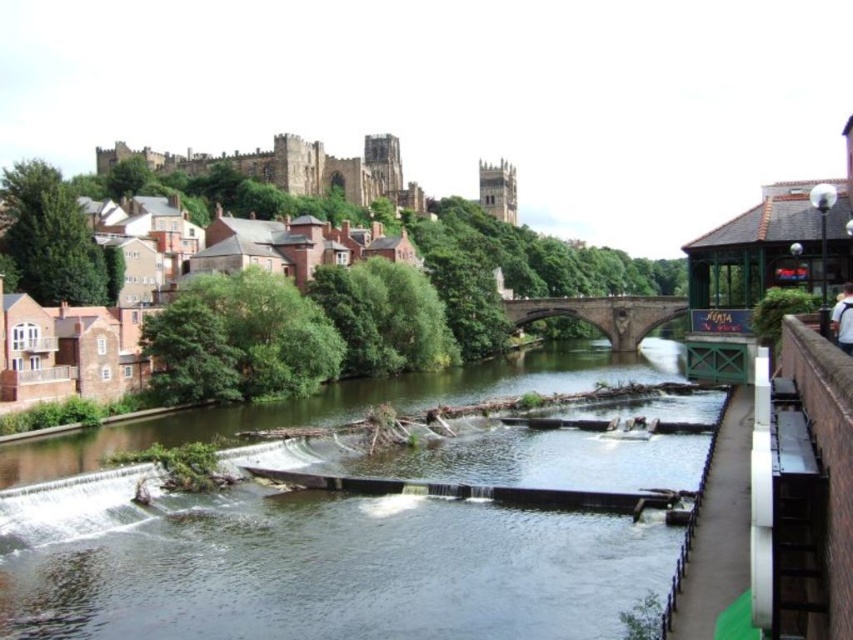
Question: Can you confirm if brown brick houses at upper left is wider than brown stone castle at upper left?

Choices:
 (A) yes
 (B) no

Answer: (B)

Question: Is smooth concrete river at center above brown stone castle at upper left?

Choices:
 (A) yes
 (B) no

Answer: (B)

Question: Based on their relative distances, which object is nearer to the smooth concrete river at center?

Choices:
 (A) brown brick houses at upper left
 (B) brown stone castle at upper left
 (C) brown stone bridge at center

Answer: (A)

Question: Is smooth concrete river at center behind brown brick houses at upper left?

Choices:
 (A) yes
 (B) no

Answer: (B)

Question: Which point is closer to the camera?

Choices:
 (A) (297, 172)
 (B) (646, 308)

Answer: (B)

Question: Which point is farther to the camera?

Choices:
 (A) smooth concrete river at center
 (B) brown stone castle at upper left

Answer: (B)